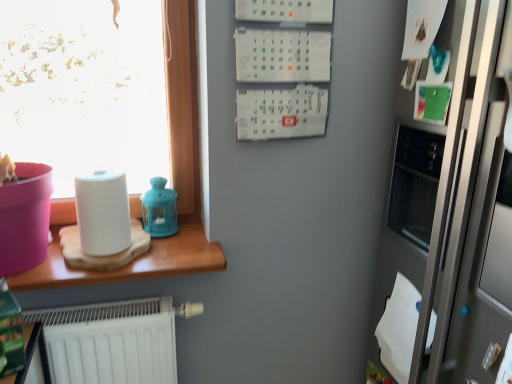
Consider the image. In order to face satin silver fridge at right, should I rotate leftwards or rightwards?

To face it directly, rotate right by 33.254 degrees.

Identify the location of matte blue lantern at upper center. (159, 209).

Identify the location of satin silver fridge at right. The image size is (512, 384). pyautogui.click(x=457, y=216).

At what (x,y) coordinates should I click in order to perform the action: click on appliance on the right of wooden table at left. Please return your answer as a coordinate pair (x, y). The image size is (512, 384). Looking at the image, I should click on (159, 209).

From a real-world perspective, which is physically above, matte blue lantern at upper center or wooden table at left?

In real-world perspective, matte blue lantern at upper center is above.

From the image's perspective, is matte blue lantern at upper center over wooden table at left?

Yes, from the image's perspective, matte blue lantern at upper center is on top of wooden table at left.

Considering the sizes of matte blue lantern at upper center and wooden table at left in the image, is matte blue lantern at upper center bigger or smaller than wooden table at left?

Clearly, matte blue lantern at upper center is smaller in size than wooden table at left.

Which is less distant, (68, 280) or (151, 221)?

The point (68, 280) is in front.

Between wooden table at left and matte blue lantern at upper center, which one appears on the right side from the viewer's perspective?

matte blue lantern at upper center is more to the right.

Which is behind, wooden table at left or matte blue lantern at upper center?

matte blue lantern at upper center is more distant.

Does wooden table at left have a greater height compared to matte blue lantern at upper center?

No.

Can you confirm if satin silver fridge at right is thinner than wooden table at left?

Incorrect, the width of satin silver fridge at right is not less than that of wooden table at left.

Is satin silver fridge at right to the left or to the right of wooden table at left in the image?

Based on their positions, satin silver fridge at right is located to the right of wooden table at left.

Is satin silver fridge at right situated inside wooden table at left or outside?

satin silver fridge at right is located beyond the bounds of wooden table at left.

The height and width of the screenshot is (384, 512). In the image, there is a satin silver fridge at right. Find the location of `table above it (from the image's perspective)`. table above it (from the image's perspective) is located at coordinates (129, 263).

Is matte blue lantern at upper center positioned behind white matte paper towel at left?

Yes, the depth of matte blue lantern at upper center is greater than that of white matte paper towel at left.

In the scene shown: Considering the relative sizes of matte blue lantern at upper center and white matte paper towel at left in the image provided, is matte blue lantern at upper center thinner than white matte paper towel at left?

Yes.

How many degrees apart are the facing directions of matte blue lantern at upper center and white matte paper towel at left?

They differ by 2.85 degrees in their facing directions.

From a real-world perspective, between matte blue lantern at upper center and white matte paper towel at left, who is vertically higher?

In real-world perspective, white matte paper towel at left is above.

Does white matte paper towel at left have a greater height compared to satin silver fridge at right?

In fact, white matte paper towel at left may be shorter than satin silver fridge at right.

Does point (102, 223) come behind point (426, 169)?

Yes, point (102, 223) is behind point (426, 169).

Measure the distance from white matte paper towel at left to satin silver fridge at right.

The distance of white matte paper towel at left from satin silver fridge at right is 35.49 inches.

Is white matte paper towel at left positioned with its back to satin silver fridge at right?

white matte paper towel at left is not turned away from satin silver fridge at right.

In terms of width, does wooden table at left look wider or thinner when compared to white matte paper towel at left?

In the image, wooden table at left appears to be wider than white matte paper towel at left.

Does wooden table at left lie in front of white matte paper towel at left?

Yes, it is in front of white matte paper towel at left.

Is there a large distance between wooden table at left and white matte paper towel at left?

wooden table at left is near white matte paper towel at left, not far away.

Considering the points (28, 289) and (103, 219), which point is behind, point (28, 289) or point (103, 219)?

The point (103, 219) is behind.

In terms of width, does satin silver fridge at right look wider or thinner when compared to matte blue lantern at upper center?

satin silver fridge at right is wider than matte blue lantern at upper center.

From a real-world perspective, between satin silver fridge at right and matte blue lantern at upper center, who is vertically higher?

matte blue lantern at upper center.

Is satin silver fridge at right to the left of matte blue lantern at upper center from the viewer's perspective?

Incorrect, satin silver fridge at right is not on the left side of matte blue lantern at upper center.

Is satin silver fridge at right aimed at matte blue lantern at upper center?

No, satin silver fridge at right is not facing towards matte blue lantern at upper center.

Find the location of a particular element. The width and height of the screenshot is (512, 384). table in front of the matte blue lantern at upper center is located at coordinates (129, 263).

At what (x,y) coordinates should I click in order to perform the action: click on appliance that is behind the wooden table at left. Please return your answer as a coordinate pair (x, y). Image resolution: width=512 pixels, height=384 pixels. Looking at the image, I should click on (159, 209).

Based on their spatial positions, is white matte paper towel at left or wooden table at left closer to matte blue lantern at upper center?

→ Based on the image, wooden table at left appears to be nearer to matte blue lantern at upper center.

Looking at the image, which one is located closer to white matte paper towel at left, matte blue lantern at upper center or wooden table at left?

Based on the image, wooden table at left appears to be nearer to white matte paper towel at left.

Which object lies nearer to the anchor point matte blue lantern at upper center, satin silver fridge at right or wooden table at left?

wooden table at left.

Estimate the real-world distances between objects in this image. Which object is further from white matte paper towel at left, wooden table at left or satin silver fridge at right?

Among the two, satin silver fridge at right is located further to white matte paper towel at left.

Which object lies nearer to the anchor point wooden table at left, white matte paper towel at left or matte blue lantern at upper center?

white matte paper towel at left lies closer to wooden table at left than the other object.

Estimate the real-world distances between objects in this image. Which object is closer to wooden table at left, white matte paper towel at left or satin silver fridge at right?

Among the two, white matte paper towel at left is located nearer to wooden table at left.

Estimate the real-world distances between objects in this image. Which object is closer to satin silver fridge at right, wooden table at left or matte blue lantern at upper center?

Based on the image, wooden table at left appears to be nearer to satin silver fridge at right.

Considering their positions, is wooden table at left positioned closer to satin silver fridge at right than white matte paper towel at left?

Based on the image, wooden table at left appears to be nearer to satin silver fridge at right.

The height and width of the screenshot is (384, 512). What are the coordinates of `paper towel positioned between wooden table at left and matte blue lantern at upper center from near to far` in the screenshot? It's located at click(103, 212).

At what (x,y) coordinates should I click in order to perform the action: click on appliance between white matte paper towel at left and satin silver fridge at right in the horizontal direction. Please return your answer as a coordinate pair (x, y). This screenshot has width=512, height=384. Looking at the image, I should click on (159, 209).

Find the location of a particular element. Image resolution: width=512 pixels, height=384 pixels. appliance situated between wooden table at left and satin silver fridge at right from left to right is located at coordinates (159, 209).

The image size is (512, 384). What are the coordinates of `paper towel between wooden table at left and satin silver fridge at right from left to right` in the screenshot? It's located at (103, 212).